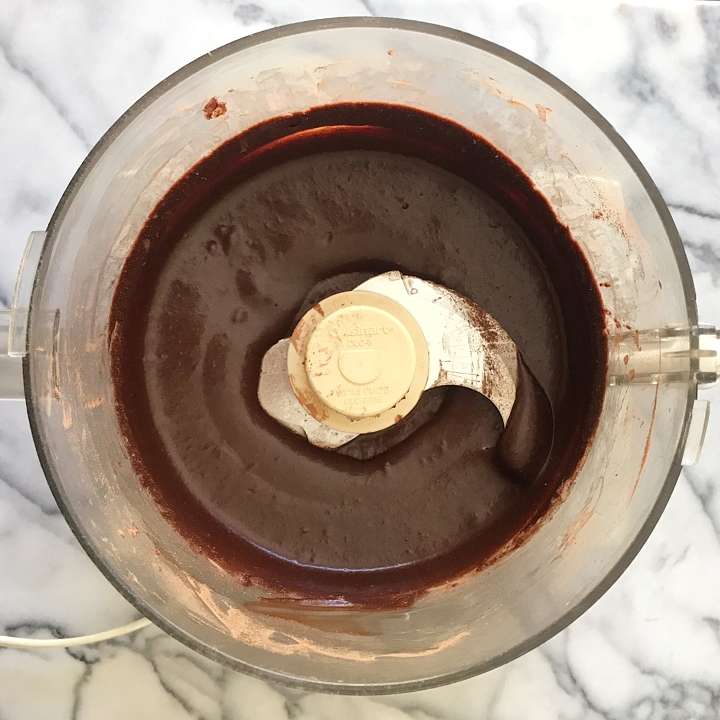
What are the coordinates of `handle` in the screenshot? It's located at (6, 373).